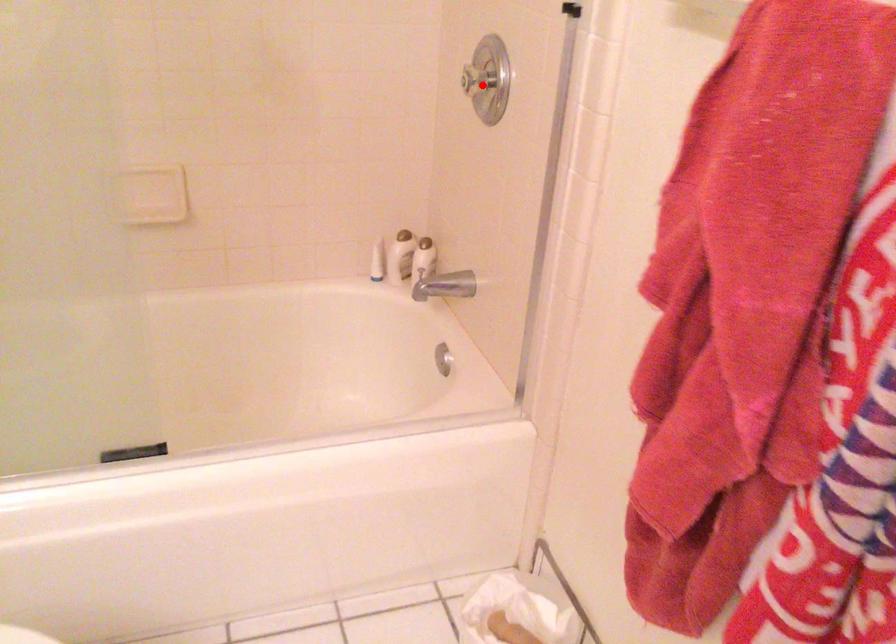
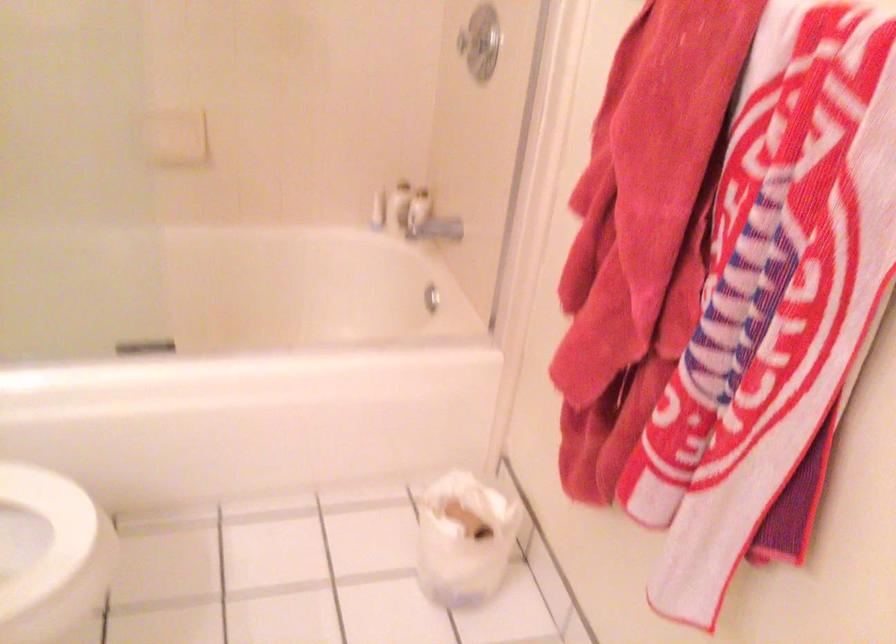
In the second image, find the point that corresponds to the highlighted location in the first image.

(478, 42)